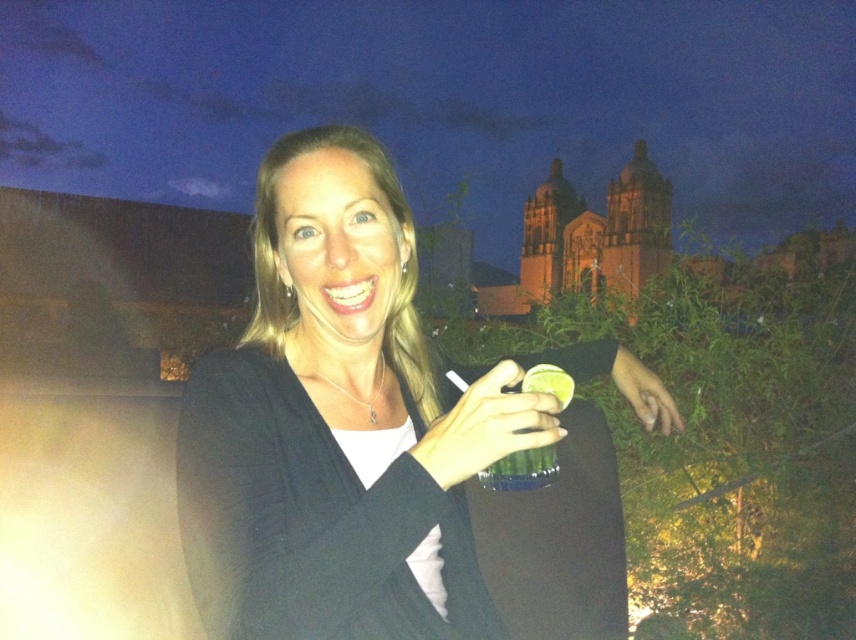
What do you see at coordinates (351, 422) in the screenshot? I see `matte black dress at center` at bounding box center [351, 422].

Who is more distant from viewer, (260, 596) or (507, 401)?

The point (507, 401) is behind.

I want to click on matte black dress at center, so click(351, 422).